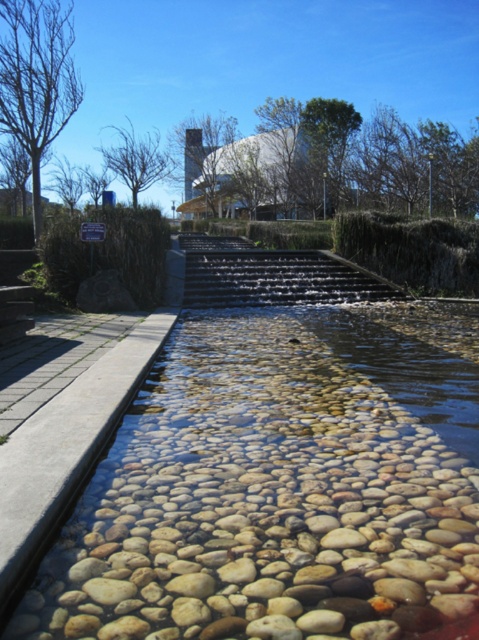
Question: In this image, where is translucent pebbles at center located relative to smooth concrete stairs at lower left?

Choices:
 (A) above
 (B) below

Answer: (B)

Question: Which object is closer to the camera taking this photo?

Choices:
 (A) black stone stairs at center
 (B) translucent pebbles at center

Answer: (B)

Question: Which of the following is the closest to the observer?

Choices:
 (A) (x=33, y=256)
 (B) (x=305, y=288)
 (C) (x=310, y=358)

Answer: (C)

Question: Does translucent pebbles at center have a lesser width compared to black stone stairs at center?

Choices:
 (A) yes
 (B) no

Answer: (A)

Question: Is the position of translucent pebbles at center less distant than that of black stone stairs at center?

Choices:
 (A) no
 (B) yes

Answer: (B)

Question: Which object is closer to the camera taking this photo?

Choices:
 (A) translucent pebbles at center
 (B) black stone stairs at center
 (C) smooth concrete stairs at lower left

Answer: (A)